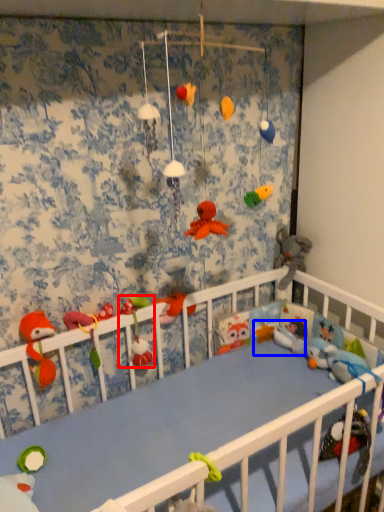
Question: Which of the following is the farthest to the observer, toy (highlighted by a red box) or toy (highlighted by a blue box)?

Choices:
 (A) toy
 (B) toy

Answer: (B)